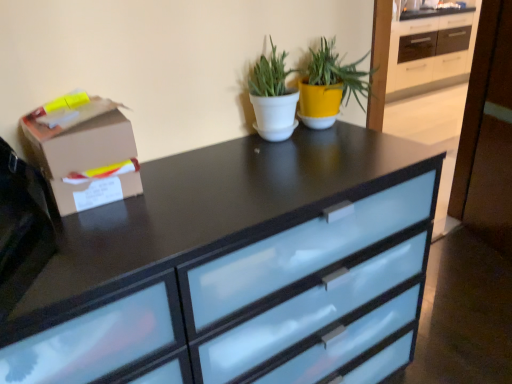
Where is `vacant point above satin black chest of drawers at center (from a real-world perspective)`? vacant point above satin black chest of drawers at center (from a real-world perspective) is located at coordinates (195, 199).